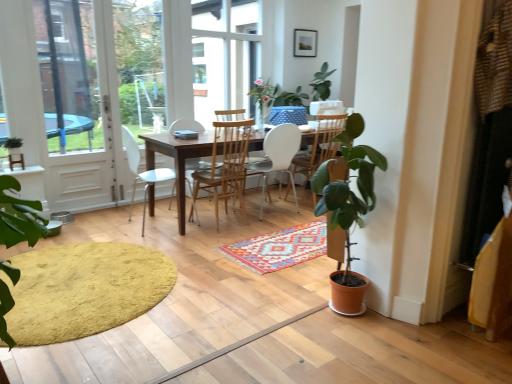
The width and height of the screenshot is (512, 384). I want to click on vacant point to the right of yellow soft rug at lower left, the second doormat from the right, so click(x=232, y=289).